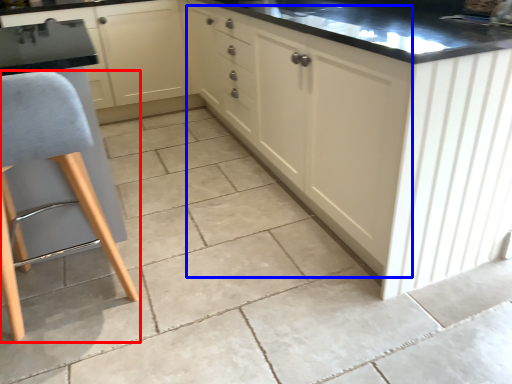
Question: Which point is closer to the camera, furniture (highlighted by a red box) or cabinetry (highlighted by a blue box)?

Choices:
 (A) furniture
 (B) cabinetry

Answer: (A)